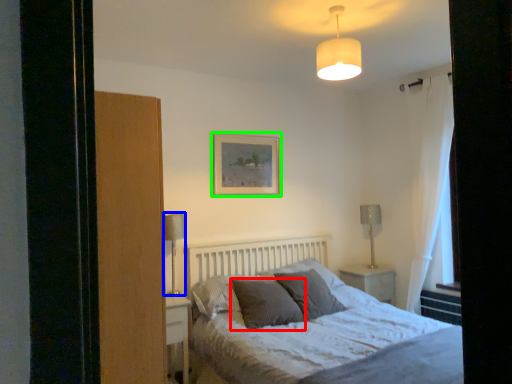
Question: Based on their relative distances, which object is nearer to pillow (highlighted by a red box)? Choose from table lamp (highlighted by a blue box) and picture frame (highlighted by a green box).

Choices:
 (A) table lamp
 (B) picture frame

Answer: (A)